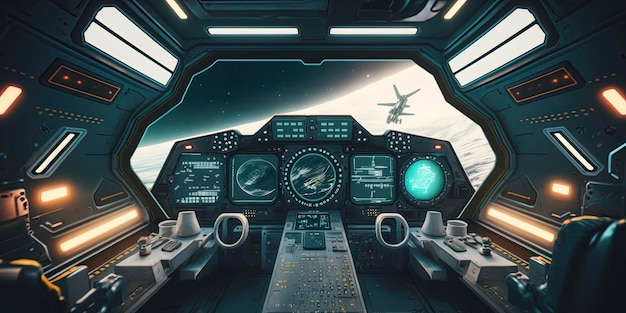
I want to click on dark bluish gray chair back, so click(610, 280), click(566, 265).